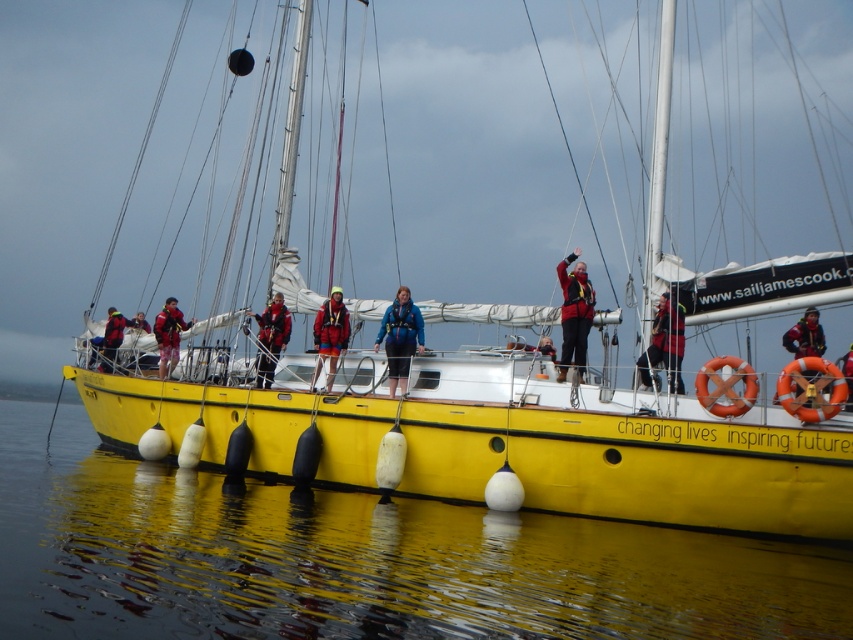
Based on the photo, you are standing on the deck of the yellow sailboat and want to jump into the water. The coordinates of the glossy water at lower center are given as point (360, 561). If you jump from where you are on the deck, will you land in the water?

The point (360, 561) indicates glossy water at lower center, so yes, jumping from the deck into that area would land you in the water.

You are a photographer trying to capture the entire scene of the glossy water at lower center and the red life jacket at center in one shot. Considering their sizes, which object should you focus on first to ensure both are fully visible in the frame?

The glossy water at lower center is bigger than the red life jacket at center, so you should focus on the glossy water at lower center first to ensure both objects are fully visible in the frame.

You are a photographer taking pictures from the shore. You notice two jackets on the sailboat at center. Which jacket, the matte black jacket at center or the matte red jacket at center, appears taller in the photo?

The matte black jacket at center appears taller in the photo because it has a greater height compared to the matte red jacket at center.